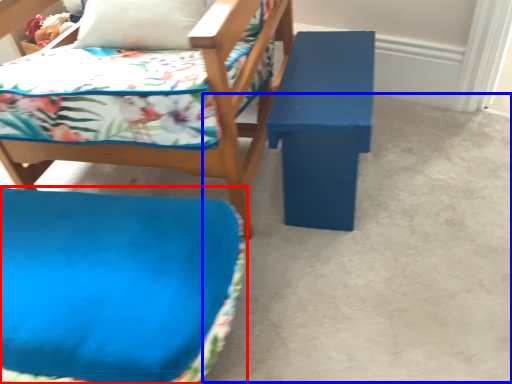
Question: Among these objects, which one is farthest to the camera, furniture (highlighted by a red box) or concrete (highlighted by a blue box)?

Choices:
 (A) furniture
 (B) concrete

Answer: (B)